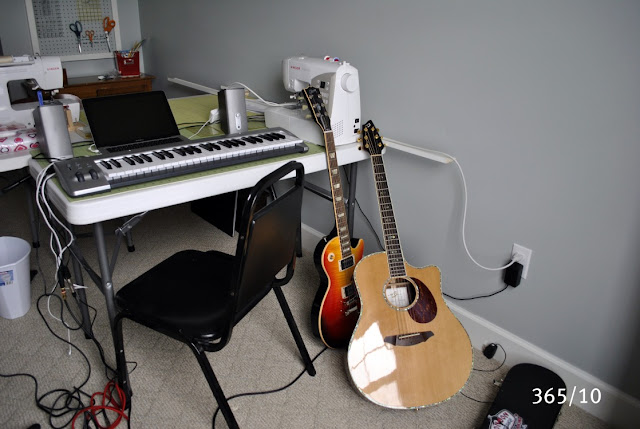
Find the location of a particular element. This screenshot has width=640, height=429. sewing machine is located at coordinates (351, 121).